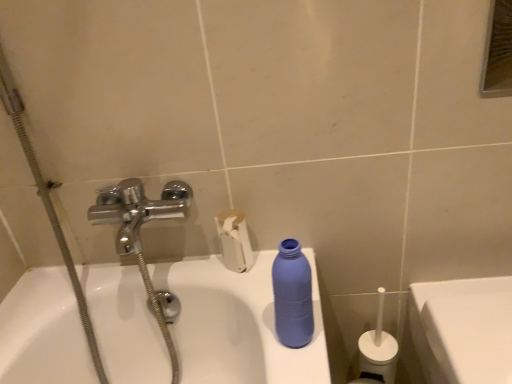
Question: Should I look upward or downward to see white glossy porcelain at lower right?

Choices:
 (A) up
 (B) down

Answer: (B)

Question: Is white matte toilet paper at upper center a part of metallic rectangular mirror at upper right?

Choices:
 (A) yes
 (B) no

Answer: (B)

Question: Is metallic rectangular mirror at upper right not within white matte toilet paper at upper center?

Choices:
 (A) yes
 (B) no

Answer: (A)

Question: Considering the relative sizes of metallic rectangular mirror at upper right and white matte toilet paper at upper center in the image provided, is metallic rectangular mirror at upper right smaller than white matte toilet paper at upper center?

Choices:
 (A) no
 (B) yes

Answer: (B)

Question: Can you confirm if metallic rectangular mirror at upper right is wider than white matte toilet paper at upper center?

Choices:
 (A) yes
 (B) no

Answer: (B)

Question: Is metallic rectangular mirror at upper right far from white matte toilet paper at upper center?

Choices:
 (A) no
 (B) yes

Answer: (B)

Question: From the image's perspective, would you say metallic rectangular mirror at upper right is shown under white matte toilet paper at upper center?

Choices:
 (A) no
 (B) yes

Answer: (A)

Question: Is matte blue plastic bottle at center looking in the opposite direction of white matte toilet paper at upper center?

Choices:
 (A) yes
 (B) no

Answer: (B)

Question: From a real-world perspective, is matte blue plastic bottle at center on white matte toilet paper at upper center?

Choices:
 (A) yes
 (B) no

Answer: (A)

Question: From a real-world perspective, is matte blue plastic bottle at center physically below white matte toilet paper at upper center?

Choices:
 (A) yes
 (B) no

Answer: (B)

Question: Is there a large distance between matte blue plastic bottle at center and white matte toilet paper at upper center?

Choices:
 (A) yes
 (B) no

Answer: (B)

Question: From the image's perspective, is matte blue plastic bottle at center over white matte toilet paper at upper center?

Choices:
 (A) no
 (B) yes

Answer: (A)

Question: From the image's perspective, is matte blue plastic bottle at center located beneath white matte toilet paper at upper center?

Choices:
 (A) no
 (B) yes

Answer: (B)

Question: Are white glossy porcelain at lower right and white matte toilet paper at upper center beside each other?

Choices:
 (A) yes
 (B) no

Answer: (B)